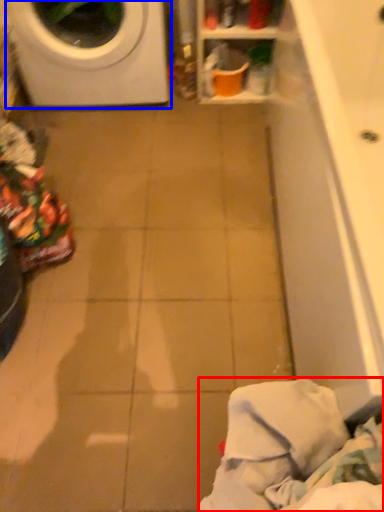
Question: Which object appears closest to the camera in this image, clothing (highlighted by a red box) or washing machine (highlighted by a blue box)?

Choices:
 (A) clothing
 (B) washing machine

Answer: (A)